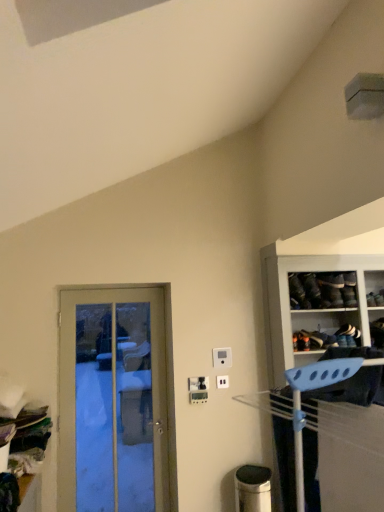
Question: In which direction should I rotate to look at white plastic electric outlet at center, the 2th electric outlet viewed from the top?

Choices:
 (A) left
 (B) right

Answer: (B)

Question: Is blue plastic hanger at right further to camera compared to white leather shoe at upper right, acting as the second shoe starting from the left?

Choices:
 (A) no
 (B) yes

Answer: (A)

Question: Is blue plastic hanger at right closer to the viewer compared to white leather shoe at upper right, acting as the 1th shoe starting from the right?

Choices:
 (A) no
 (B) yes

Answer: (B)

Question: Considering the relative sizes of blue plastic hanger at right and white leather shoe at upper right, acting as the 1th shoe starting from the right, in the image provided, is blue plastic hanger at right shorter than white leather shoe at upper right, acting as the 1th shoe starting from the right,?

Choices:
 (A) yes
 (B) no

Answer: (B)

Question: Is white leather shoe at upper right, acting as the 1th shoe starting from the right, at the back of blue plastic hanger at right?

Choices:
 (A) no
 (B) yes

Answer: (A)

Question: Is blue plastic hanger at right wider than white leather shoe at upper right, acting as the 1th shoe starting from the right?

Choices:
 (A) no
 (B) yes

Answer: (B)

Question: From the image's perspective, is blue plastic hanger at right under white leather shoe at upper right, acting as the second shoe starting from the left?

Choices:
 (A) no
 (B) yes

Answer: (A)

Question: Is leather black shoe at upper right, placed as the 2th shoe when sorted from right to left, far away from white plastic electric outlet at center, which is the third electric outlet in bottom-to-top order?

Choices:
 (A) no
 (B) yes

Answer: (A)

Question: Does leather black shoe at upper right, which is counted as the second shoe, starting from the bottom, have a greater height compared to white plastic electric outlet at center, the first electric outlet from the top?

Choices:
 (A) yes
 (B) no

Answer: (A)

Question: Considering the relative sizes of leather black shoe at upper right, placed as the 2th shoe when sorted from right to left, and white plastic electric outlet at center, the first electric outlet from the top, in the image provided, is leather black shoe at upper right, placed as the 2th shoe when sorted from right to left, bigger than white plastic electric outlet at center, the first electric outlet from the top,?

Choices:
 (A) no
 (B) yes

Answer: (B)

Question: Is leather black shoe at upper right, positioned as the first shoe in top-to-bottom order, aimed at white plastic electric outlet at center, which is the third electric outlet in bottom-to-top order?

Choices:
 (A) yes
 (B) no

Answer: (B)

Question: Can we say leather black shoe at upper right, which is counted as the second shoe, starting from the bottom, lies outside white plastic electric outlet at center, the first electric outlet from the top?

Choices:
 (A) yes
 (B) no

Answer: (A)

Question: From a real-world perspective, is leather black shoe at upper right, which is counted as the second shoe, starting from the bottom, on white plastic electric outlet at center, the first electric outlet from the top?

Choices:
 (A) no
 (B) yes

Answer: (B)

Question: From the image's perspective, would you say white leather shoe at upper right, acting as the 1th shoe starting from the right, is shown under blue plastic hanger at right?

Choices:
 (A) yes
 (B) no

Answer: (A)